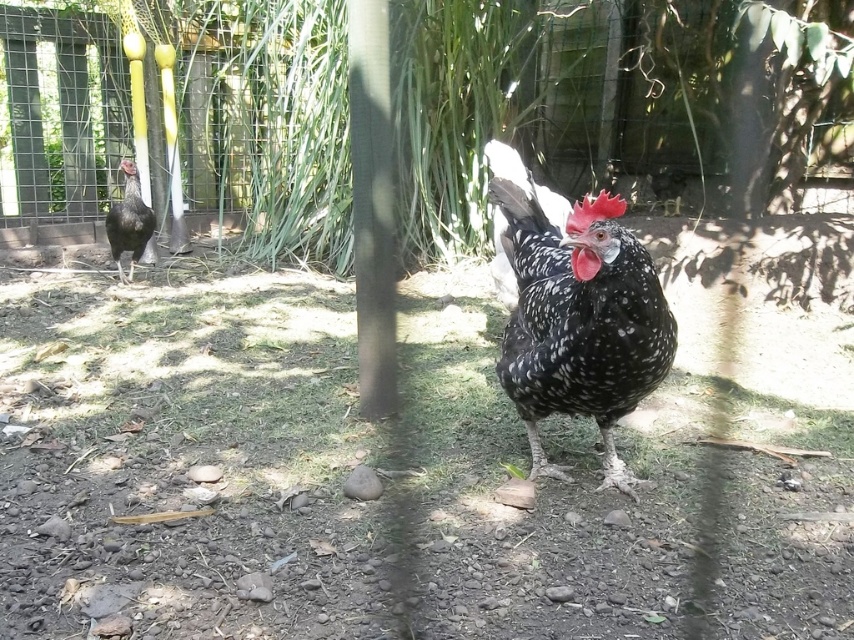
In the scene shown: Who is taller, green leafy tree at center or satin black chicken at left?

green leafy tree at center is taller.

Is point (530, 12) closer to camera compared to point (129, 218)?

That is False.

Find the location of `green leafy tree at center`. green leafy tree at center is located at coordinates (607, 100).

Locate an element on the screen. This screenshot has width=854, height=640. green leafy tree at center is located at coordinates (607, 100).

Does green leafy tree at center appear on the right side of speckled feathered chicken at center?

Yes, green leafy tree at center is to the right of speckled feathered chicken at center.

The image size is (854, 640). Describe the element at coordinates (607, 100) in the screenshot. I see `green leafy tree at center` at that location.

Does point (288, 200) come farther from viewer compared to point (612, 212)?

Yes, point (288, 200) is behind point (612, 212).

Image resolution: width=854 pixels, height=640 pixels. Find the location of `green leafy tree at center`. green leafy tree at center is located at coordinates (607, 100).

Can you confirm if speckled feathered chicken at center is positioned to the right of satin black chicken at left?

Indeed, speckled feathered chicken at center is positioned on the right side of satin black chicken at left.

Is speckled feathered chicken at center smaller than satin black chicken at left?

Actually, speckled feathered chicken at center might be larger than satin black chicken at left.

Does point (668, 314) come closer to viewer compared to point (132, 192)?

Yes, it is.

Identify the location of speckled feathered chicken at center. The width and height of the screenshot is (854, 640). (578, 316).